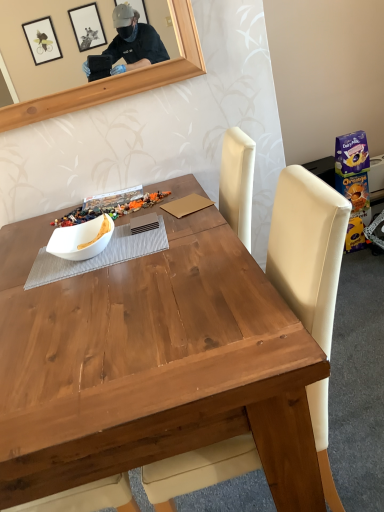
I want to click on white matte bowl at center, so click(x=92, y=229).

What do you see at coordinates (92, 229) in the screenshot? I see `white matte bowl at center` at bounding box center [92, 229].

Find the location of `white matte bowl at center`. white matte bowl at center is located at coordinates (81, 239).

You are a GUI agent. You are given a task and a screenshot of the screen. Output one action in this format:
    pyautogui.click(x=<x>, y=<y>)
    Task: Click on the wooden chair at center
    
    Given the screenshot: What is the action you would take?
    [x=308, y=249]

Is point (59, 234) in front of point (56, 252)?

No, it is not.

Can you confirm if white matte bowl at center is taller than white matte bowl at center?

No.

From the image's perspective, does white matte bowl at center appear lower than white matte bowl at center?

Actually, white matte bowl at center appears above white matte bowl at center in the image.

Can you tell me how much white matte bowl at center and white matte bowl at center differ in facing direction?

The facing directions of white matte bowl at center and white matte bowl at center are 0.00505 degrees apart.

Does wooden chair at center appear on the left side of white matte bowl at center?

No.

Can you confirm if wooden chair at center is taller than white matte bowl at center?

Indeed, wooden chair at center has a greater height compared to white matte bowl at center.

Which point is more distant from viewer, (199, 453) or (69, 238)?

The point (69, 238) is behind.

Is wooden chair at center situated inside white matte bowl at center or outside?

The correct answer is: outside.

From the picture: Considering the sizes of objects white matte bowl at center and wooden chair at center in the image provided, who is shorter, white matte bowl at center or wooden chair at center?

With less height is white matte bowl at center.

Is white matte bowl at center outside of wooden chair at center?

That's correct, white matte bowl at center is outside of wooden chair at center.

Is white matte bowl at center far from wooden chair at center?

That's not correct — white matte bowl at center is a little close to wooden chair at center.

Is the position of white matte bowl at center less distant than that of wooden chair at center?

No, white matte bowl at center is further to the viewer.

In the scene shown: Considering the relative positions of white matte bowl at center and white matte bowl at center in the image provided, is white matte bowl at center in front of white matte bowl at center?

Yes, it is in front of white matte bowl at center.

Is white matte bowl at center next to white matte bowl at center?

Yes, white matte bowl at center is next to white matte bowl at center.

From a real-world perspective, is white matte bowl at center over white matte bowl at center?

Indeed, from a real-world perspective, white matte bowl at center stands above white matte bowl at center.

Is white matte bowl at center oriented away from white matte bowl at center?

Yes, white matte bowl at center is at the back of white matte bowl at center.

How different are the orientations of wooden chair at center and white matte bowl at center in degrees?

There is a 96.1-degree angle between the facing directions of wooden chair at center and white matte bowl at center.

Find the location of a particular element. chair lying on the right of white matte bowl at center is located at coordinates (308, 249).

Is point (321, 307) farther from camera compared to point (112, 218)?

No, it is not.

Is wooden chair at center at the right side of white matte bowl at center?

Yes.

Are white matte bowl at center and wooden chair at center making contact?

No, white matte bowl at center is not touching wooden chair at center.

Is white matte bowl at center located outside wooden chair at center?

That's correct, white matte bowl at center is outside of wooden chair at center.

Which is closer to the camera, (100,234) or (198,456)?

The point (198,456) is closer.

Which object is further away from the camera, white matte bowl at center or wooden chair at center?

white matte bowl at center is further away from the camera.

The image size is (384, 512). Identify the location of fruit dish beneath the white matte bowl at center (from a real-world perspective). (x=92, y=229).

What are the coordinates of `chair in front of the white matte bowl at center` in the screenshot? It's located at (308, 249).

Looking at the image, which one is located further to white matte bowl at center, white matte bowl at center or wooden chair at center?

Based on the image, wooden chair at center appears to be further to white matte bowl at center.

Based on their spatial positions, is white matte bowl at center or white matte bowl at center closer to wooden chair at center?

white matte bowl at center lies closer to wooden chair at center than the other object.

Considering their positions, is white matte bowl at center positioned further to wooden chair at center than white matte bowl at center?

Based on the image, white matte bowl at center appears to be further to wooden chair at center.

Which object lies nearer to the anchor point white matte bowl at center, wooden chair at center or white matte bowl at center?

Among the two, white matte bowl at center is located nearer to white matte bowl at center.

When comparing their distances from white matte bowl at center, does wooden chair at center or white matte bowl at center seem closer?

white matte bowl at center is closer to white matte bowl at center.

Estimate the real-world distances between objects in this image. Which object is further from white matte bowl at center, white matte bowl at center or wooden chair at center?

Based on the image, wooden chair at center appears to be further to white matte bowl at center.

The width and height of the screenshot is (384, 512). I want to click on bowl between wooden chair at center and white matte bowl at center along the z-axis, so click(x=81, y=239).